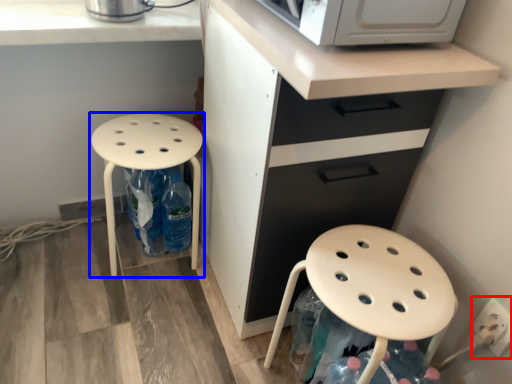
Question: Among these objects, which one is nearest to the camera, electric outlet (highlighted by a red box) or stool (highlighted by a blue box)?

Choices:
 (A) electric outlet
 (B) stool

Answer: (A)